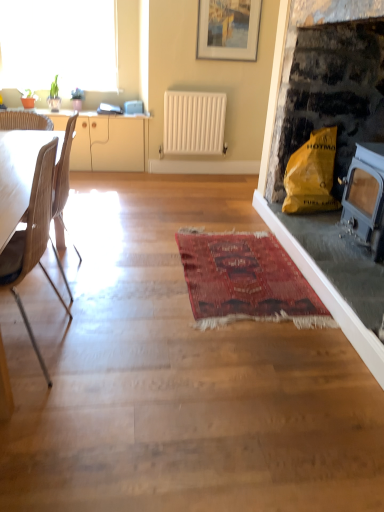
Question: Is transparent glass window at upper left smaller than light brown wood chair at left, placed as the first chair when sorted from back to front?

Choices:
 (A) no
 (B) yes

Answer: (A)

Question: Is transparent glass window at upper left bigger than light brown wood chair at left, which appears as the second chair when viewed from the front?

Choices:
 (A) yes
 (B) no

Answer: (A)

Question: Could you tell me if transparent glass window at upper left is facing light brown wood chair at left, placed as the first chair when sorted from back to front?

Choices:
 (A) yes
 (B) no

Answer: (A)

Question: From the image's perspective, would you say transparent glass window at upper left is positioned over light brown wood chair at left, placed as the first chair when sorted from back to front?

Choices:
 (A) no
 (B) yes

Answer: (B)

Question: Considering the relative positions of transparent glass window at upper left and light brown wood chair at left, which appears as the second chair when viewed from the front, in the image provided, is transparent glass window at upper left to the right of light brown wood chair at left, which appears as the second chair when viewed from the front, from the viewer's perspective?

Choices:
 (A) no
 (B) yes

Answer: (A)

Question: From the image's perspective, is yellow paper bag at right located above or below red woven rug at center?

Choices:
 (A) below
 (B) above

Answer: (B)

Question: From a real-world perspective, is yellow paper bag at right above or below red woven rug at center?

Choices:
 (A) above
 (B) below

Answer: (A)

Question: Looking at the image, does yellow paper bag at right seem bigger or smaller compared to red woven rug at center?

Choices:
 (A) big
 (B) small

Answer: (A)

Question: Based on their positions, is yellow paper bag at right located to the left or right of red woven rug at center?

Choices:
 (A) left
 (B) right

Answer: (B)

Question: From a real-world perspective, is white matte radiator at center physically located above or below beige wood cabinet at left?

Choices:
 (A) above
 (B) below

Answer: (A)

Question: Is point (218, 110) closer or farther from the camera than point (145, 117)?

Choices:
 (A) farther
 (B) closer

Answer: (B)

Question: Is white matte radiator at center to the left or to the right of beige wood cabinet at left in the image?

Choices:
 (A) right
 (B) left

Answer: (A)

Question: Looking at their shapes, would you say white matte radiator at center is wider or thinner than beige wood cabinet at left?

Choices:
 (A) wide
 (B) thin

Answer: (B)

Question: Is point (175, 144) positioned closer to the camera than point (69, 10)?

Choices:
 (A) closer
 (B) farther

Answer: (A)

Question: Considering the positions of white matte radiator at center and transparent glass window at upper left in the image, is white matte radiator at center taller or shorter than transparent glass window at upper left?

Choices:
 (A) short
 (B) tall

Answer: (A)